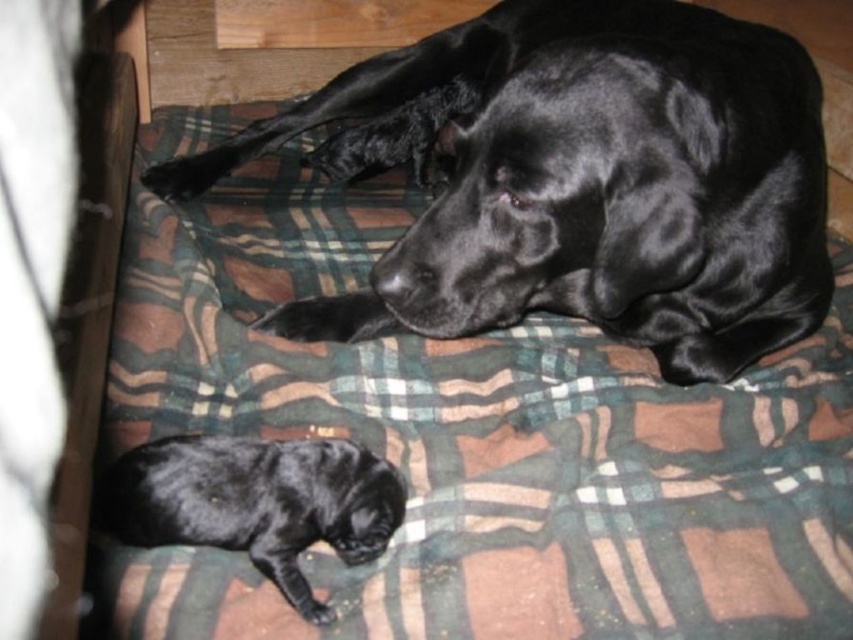
Question: Does shiny black dog at center appear on the right side of shiny black puppy at lower left?

Choices:
 (A) no
 (B) yes

Answer: (B)

Question: In this image, where is shiny black dog at center located relative to shiny black puppy at lower left?

Choices:
 (A) below
 (B) above

Answer: (B)

Question: Which point is farther to the camera?

Choices:
 (A) (193, 467)
 (B) (686, 346)

Answer: (B)

Question: Which of the following is the farthest from the observer?

Choices:
 (A) shiny black puppy at lower left
 (B) shiny black dog at center

Answer: (B)

Question: Does shiny black dog at center appear under shiny black puppy at lower left?

Choices:
 (A) no
 (B) yes

Answer: (A)

Question: Which point is closer to the camera?

Choices:
 (A) (206, 177)
 (B) (341, 509)

Answer: (B)